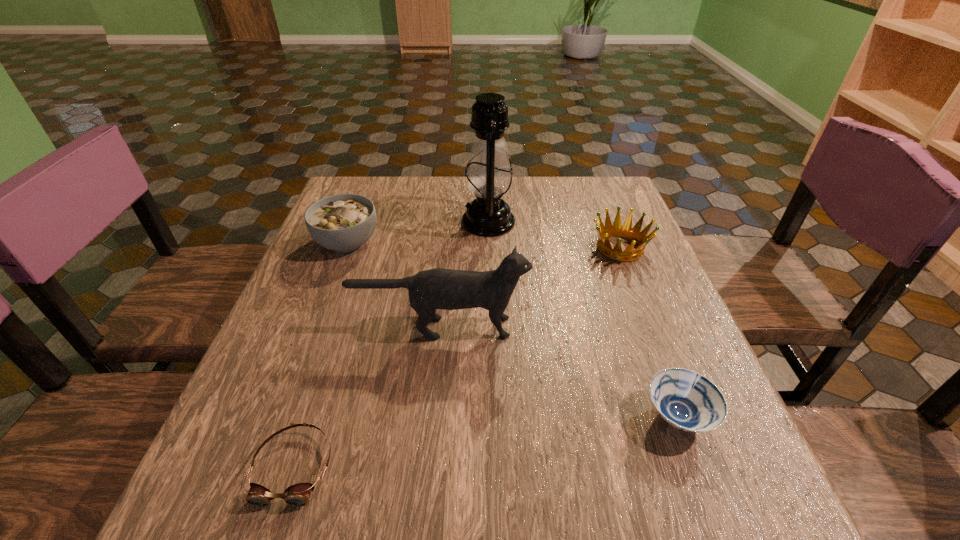
Find the location of a particular element. object located at the near left corner is located at coordinates (x=298, y=495).

Where is `free space at the far edge of the desktop`? This screenshot has height=540, width=960. free space at the far edge of the desktop is located at coordinates (525, 185).

What are the coordinates of `vacant region at the near edge of the desktop` in the screenshot? It's located at (444, 507).

Locate an element on the screen. This screenshot has height=540, width=960. vacant space at the left edge of the desktop is located at coordinates (322, 279).

Find the location of a particular element. This screenshot has width=960, height=540. vacant region at the right edge is located at coordinates (585, 235).

The image size is (960, 540). Identify the location of blank space at the far left corner. (377, 212).

The width and height of the screenshot is (960, 540). I want to click on free space between the fifth tallest object and the farther soup bowl, so click(x=513, y=329).

In order to click on free space between the second shortest object and the shortest object in this screenshot , I will do `click(486, 442)`.

At what (x,y) coordinates should I click in order to perform the action: click on free space between the third nearest object and the fourth tallest object. Please return your answer as a coordinate pair (x, y). The image size is (960, 540). Looking at the image, I should click on (530, 288).

Where is `vacant area that lies between the oil lamp and the farther soup bowl`? vacant area that lies between the oil lamp and the farther soup bowl is located at coordinates (418, 232).